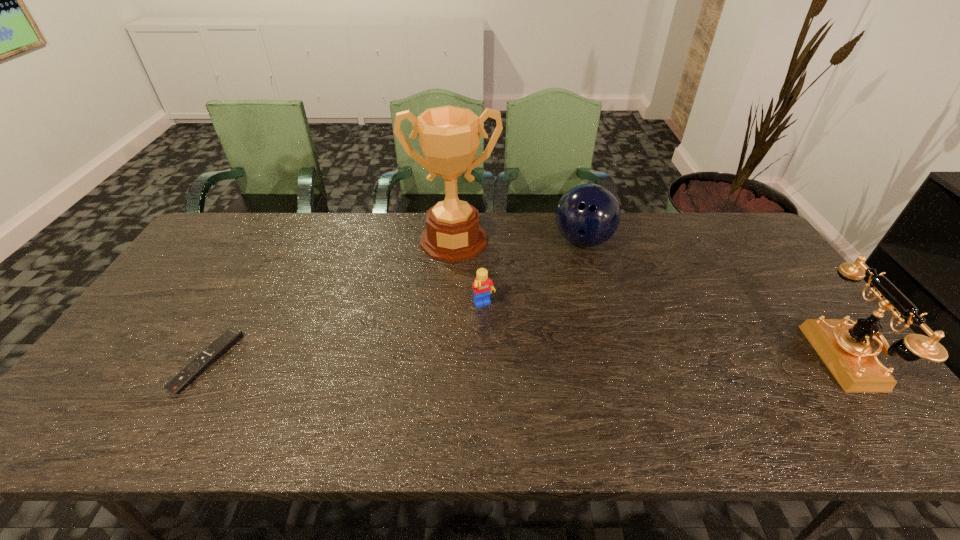
Select which object appears as the second closest to the shortest object. Please provide its 2D coordinates. Your answer should be formatted as a tuple, i.e. [(x, y)], where the tuple contains the x and y coordinates of a point satisfying the conditions above.

[(482, 286)]

Identify which object is the second closest to the rightmost object. Please provide its 2D coordinates. Your answer should be formatted as a tuple, i.e. [(x, y)], where the tuple contains the x and y coordinates of a point satisfying the conditions above.

[(482, 286)]

Identify the location of vacant space that satisfies the following two spatial constraints: 1. on the front side of the tallest object; 2. on the dial of the telephone. (445, 359).

Identify the location of vacant position in the image that satisfies the following two spatial constraints: 1. on the front side of the rightmost object; 2. on the dial of the third farthest object. The height and width of the screenshot is (540, 960). (485, 359).

You are a GUI agent. You are given a task and a screenshot of the screen. Output one action in this format:
    pyautogui.click(x=<x>, y=<y>)
    Task: Click on the free spot that satisfies the following two spatial constraints: 1. on the front side of the third shortest object; 2. on the dial of the rightmost object
    
    Given the screenshot: What is the action you would take?
    pyautogui.click(x=616, y=359)